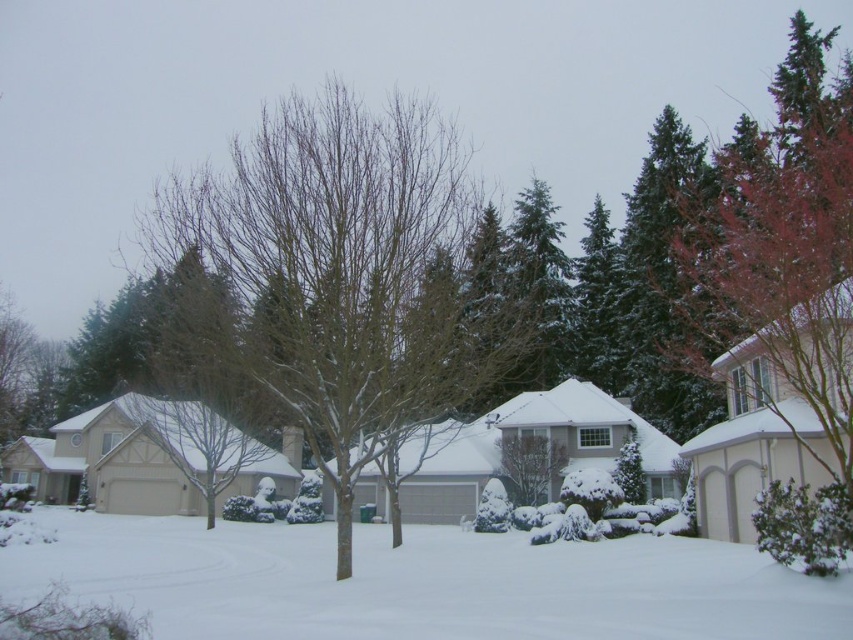
You are standing at the center of the image. Looking at the scene, where exactly is the bare branches at center located in terms of coordinates?

The bare branches at center are located at coordinates point (343, 275).

You are a snowman builder standing in the residential neighborhood. You want to make a snowman using the white fluffy snow at center. However, there is a green textured evergreen tree at center nearby. Will the snowman be taller than the tree?

The white fluffy snow at center is not as tall as the green textured evergreen tree at center, so the snowman made from it will also not be taller than the tree.

You are a bird looking for a place to land. You see the bare branches at center and the white fluffy snow at center. Which one is taller?

The bare branches at center is taller than the white fluffy snow at center, so the bird should land on the bare branches at center if it prefers a higher perch.